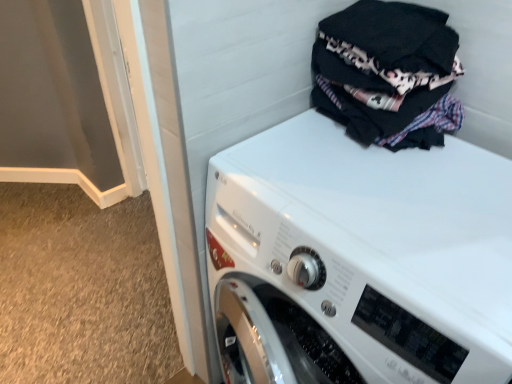
Find the location of `vacant space situated above white glossy washing machine at upper right (from a real-world perspective)`. vacant space situated above white glossy washing machine at upper right (from a real-world perspective) is located at coordinates (385, 197).